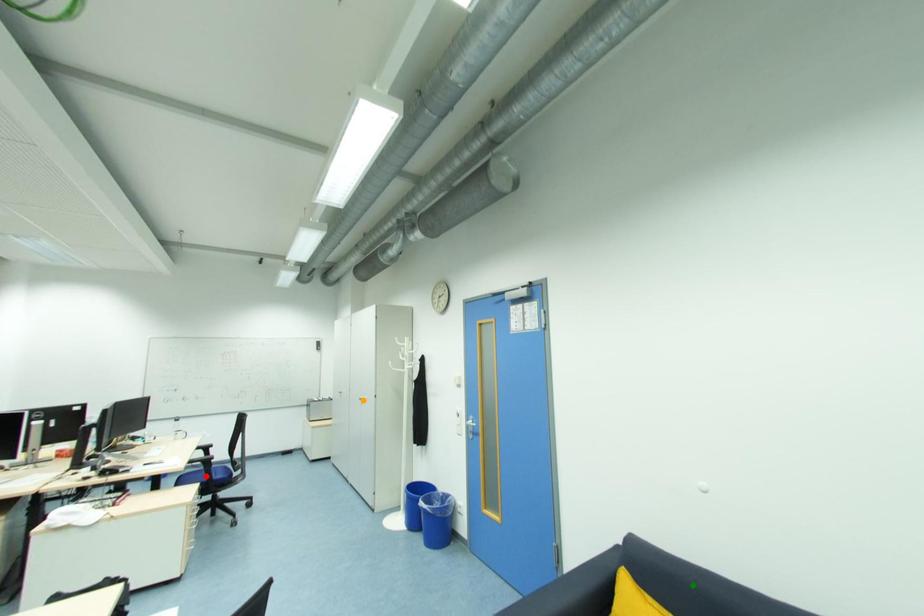
Order these from nearest to farthest:
A) green point
B) red point
C) orange point

green point < red point < orange point